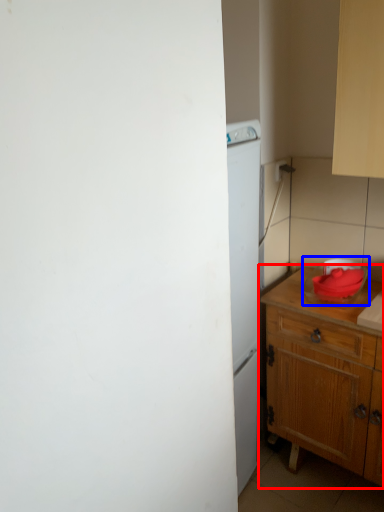
Question: Which object appears closest to the camera in this image, table (highlighted by a red box) or appliance (highlighted by a blue box)?

Choices:
 (A) table
 (B) appliance

Answer: (A)